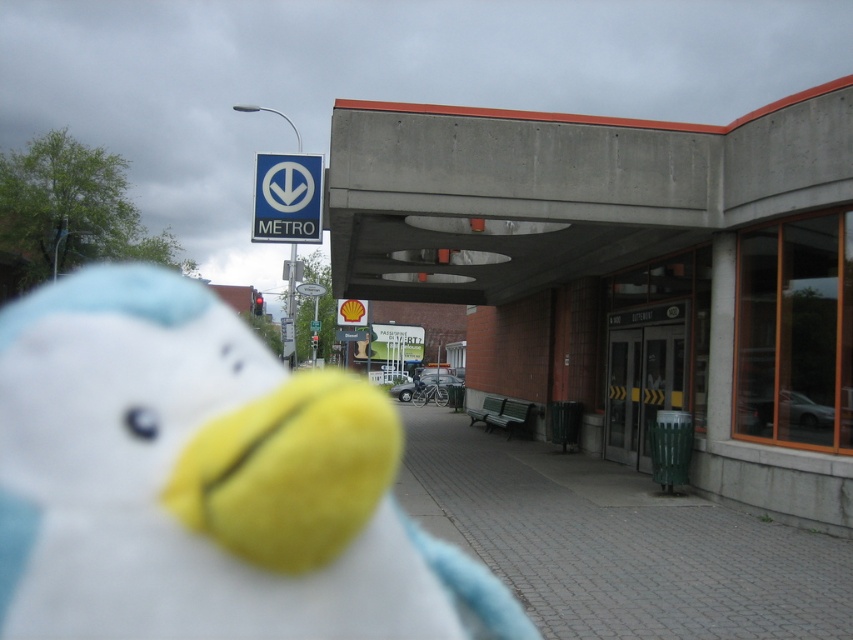
Between fluffy white toy at center and paved brick sidewalk at center, which one has more height?

With more height is fluffy white toy at center.

Does fluffy white toy at center have a lesser height compared to paved brick sidewalk at center?

No.

The image size is (853, 640). Describe the element at coordinates (204, 481) in the screenshot. I see `fluffy white toy at center` at that location.

This screenshot has height=640, width=853. Identify the location of fluffy white toy at center. (204, 481).

In the scene shown: Can you confirm if paved brick sidewalk at center is smaller than blue plastic sign at upper center?

Incorrect, paved brick sidewalk at center is not smaller in size than blue plastic sign at upper center.

Is paved brick sidewalk at center taller than blue plastic sign at upper center?

Yes.

Which is in front, point (695, 595) or point (276, 173)?

Positioned in front is point (695, 595).

This screenshot has width=853, height=640. In order to click on paved brick sidewalk at center in this screenshot , I will do `click(616, 541)`.

Does fluffy white toy at center have a larger size compared to blue plastic sign at upper center?

Correct, fluffy white toy at center is larger in size than blue plastic sign at upper center.

Which is in front, point (399, 449) or point (285, 157)?

Point (285, 157) is in front.

Does point (93, 604) come closer to viewer compared to point (300, 196)?

Yes, it is in front of point (300, 196).

Locate an element on the screen. The height and width of the screenshot is (640, 853). fluffy white toy at center is located at coordinates (204, 481).